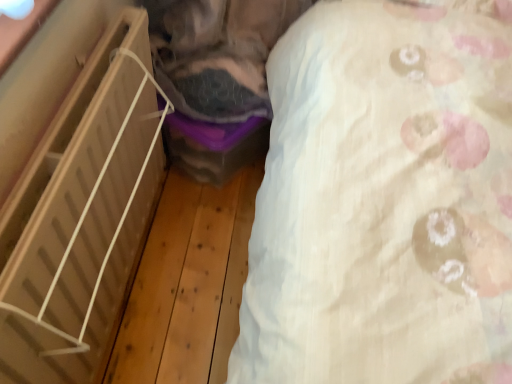
Question: Is white textured sheet at upper right smaller than light wood shelf at left?

Choices:
 (A) yes
 (B) no

Answer: (A)

Question: Does white textured sheet at upper right appear on the right side of light wood shelf at left?

Choices:
 (A) no
 (B) yes

Answer: (B)

Question: From the image's perspective, is white textured sheet at upper right on top of light wood shelf at left?

Choices:
 (A) yes
 (B) no

Answer: (A)

Question: Would you consider white textured sheet at upper right to be distant from light wood shelf at left?

Choices:
 (A) no
 (B) yes

Answer: (A)

Question: From the image's perspective, would you say white textured sheet at upper right is shown under light wood shelf at left?

Choices:
 (A) no
 (B) yes

Answer: (A)

Question: Is white textured sheet at upper right wider than light wood shelf at left?

Choices:
 (A) no
 (B) yes

Answer: (A)

Question: Does light wood shelf at left turn towards white textured sheet at upper right?

Choices:
 (A) no
 (B) yes

Answer: (B)

Question: Can white textured sheet at upper right be found inside light wood shelf at left?

Choices:
 (A) no
 (B) yes

Answer: (A)

Question: Would you say light wood shelf at left is outside white textured sheet at upper right?

Choices:
 (A) yes
 (B) no

Answer: (A)

Question: From the image's perspective, is light wood shelf at left on white textured sheet at upper right?

Choices:
 (A) yes
 (B) no

Answer: (B)

Question: From the image's perspective, is light wood shelf at left below white textured sheet at upper right?

Choices:
 (A) no
 (B) yes

Answer: (B)

Question: Is there a large distance between light wood shelf at left and white textured sheet at upper right?

Choices:
 (A) yes
 (B) no

Answer: (B)

Question: Relative to light wood shelf at left, is white textured sheet at upper right in front or behind?

Choices:
 (A) front
 (B) behind

Answer: (A)